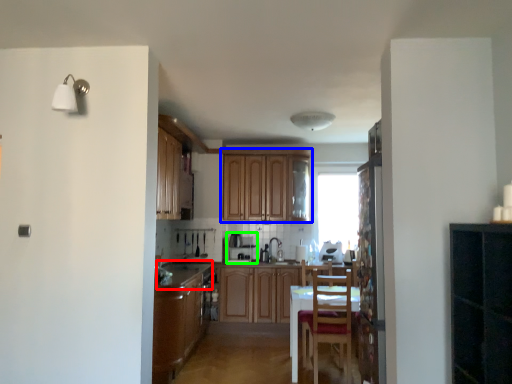
Question: Which object is the closest to the counter top (highlighted by a red box)? Choose among these: cabinetry (highlighted by a blue box) or appliance (highlighted by a green box).

Choices:
 (A) cabinetry
 (B) appliance

Answer: (B)